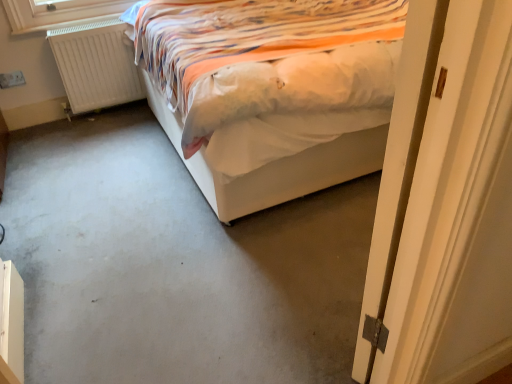
This screenshot has height=384, width=512. What are the coordinates of `vacant space underneath white matte radiator at left (from a real-world perspective)` in the screenshot? It's located at (110, 109).